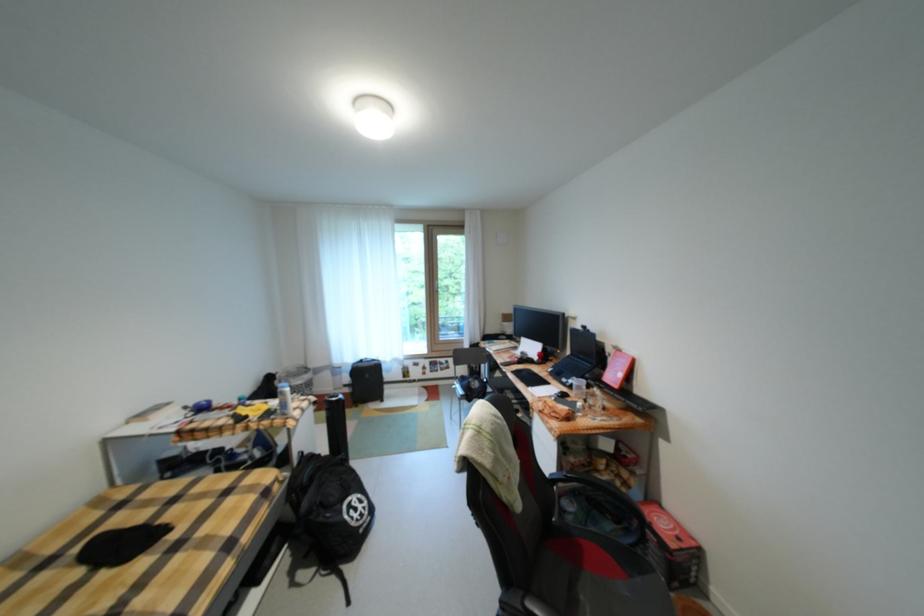
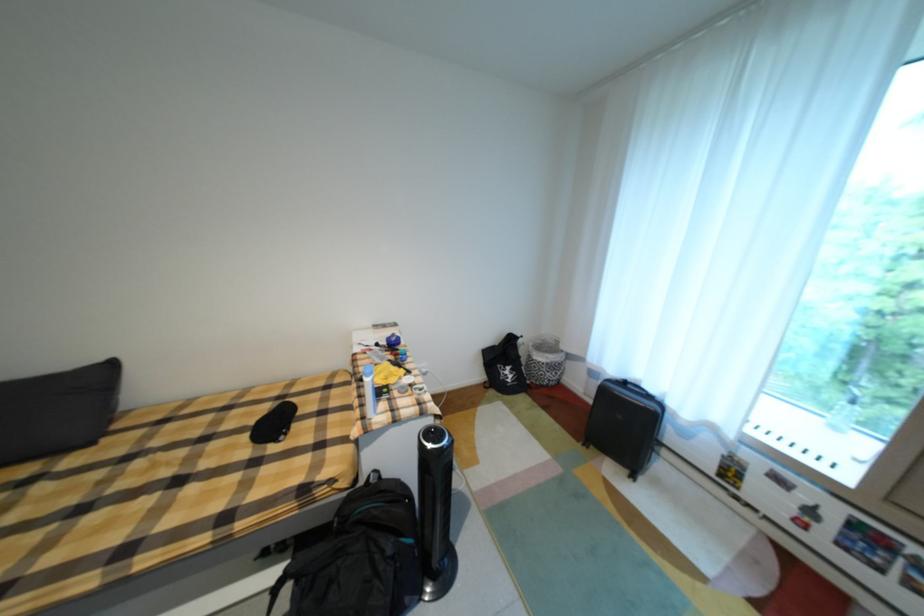
The point at (322, 480) is marked in the first image. Where is the corresponding point in the second image?

(370, 525)